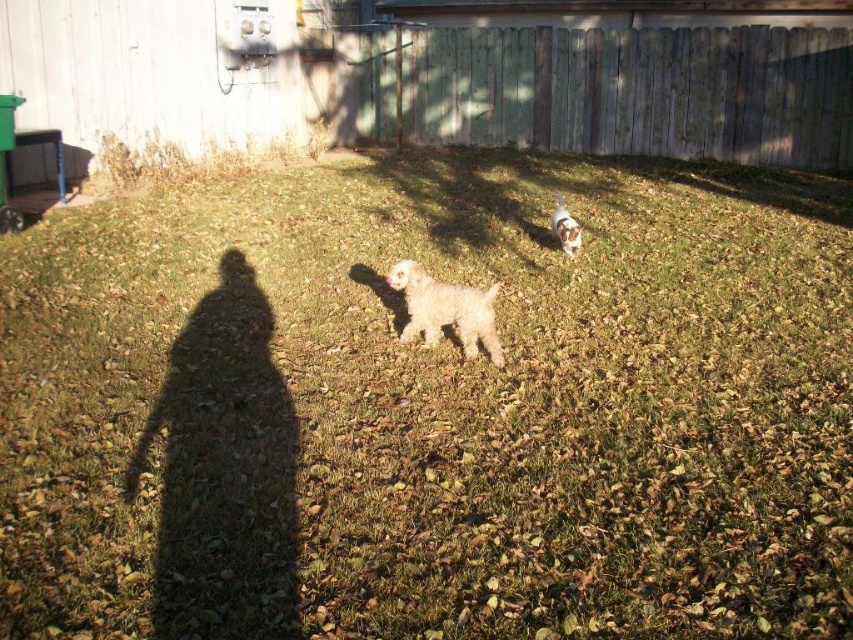
You are a photographer trying to capture both the weathered wood fence at upper center and the white fluffy dog at upper right in the same frame. Based on their sizes in the image, which one will appear larger in your photo?

The weathered wood fence at upper center will appear larger in the photo because it is bigger than the white fluffy dog at upper right.

You are trying to determine which dog is closer to you based on their sizes. You see a white fluffy dog at center and a white fluffy dog at upper right. Which one is closer?

The white fluffy dog at center is closer because it appears larger than the white fluffy dog at upper right, and objects closer to the viewer generally appear larger.

You are a photographer standing in the backyard and want to take a photo of the weathered wood fence at upper center and the white fluffy dog at upper right. If your camera can focus on objects up to 5 meters away, will both subjects be in focus?

The weathered wood fence at upper center is 6.22 meters away from the white fluffy dog at upper right. Since the camera can only focus up to 5 meters, the distance between them exceeds the camera range. Therefore, both subjects cannot be in focus simultaneously.